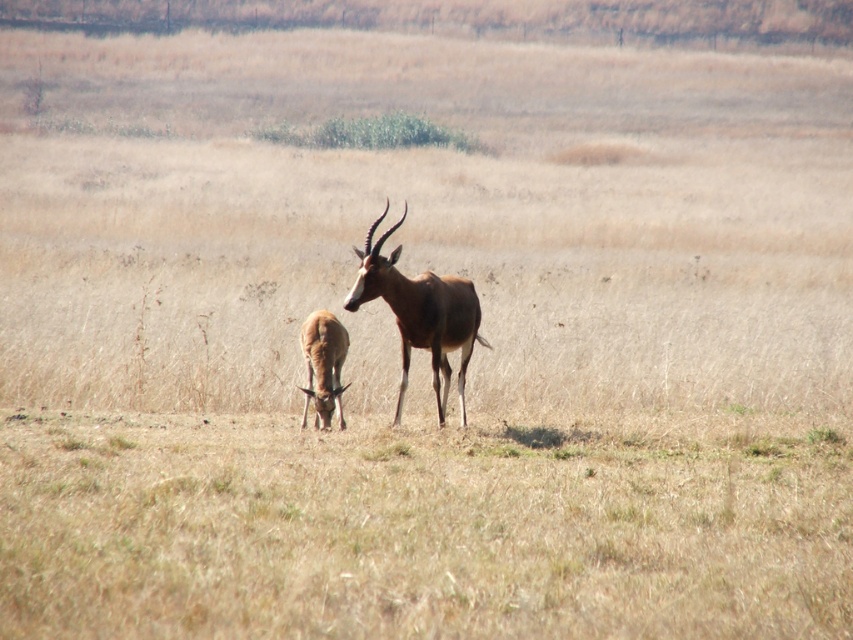
Does brown glossy antelope at center come in front of brown smooth antelope at lower left?

Yes, brown glossy antelope at center is closer to the viewer.

Does brown glossy antelope at center have a lesser height compared to brown smooth antelope at lower left?

No.

Where is `brown glossy antelope at center`? This screenshot has width=853, height=640. brown glossy antelope at center is located at coordinates (x=421, y=314).